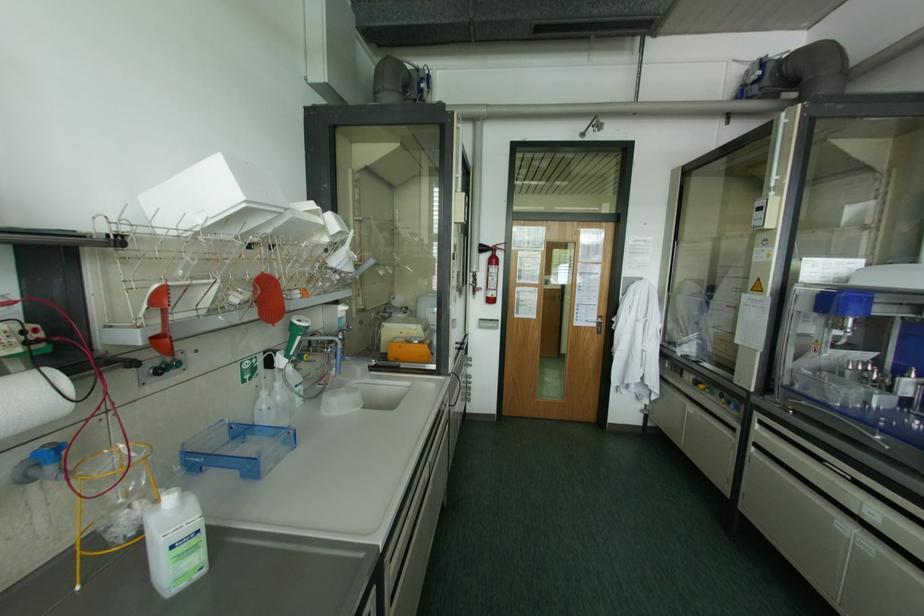
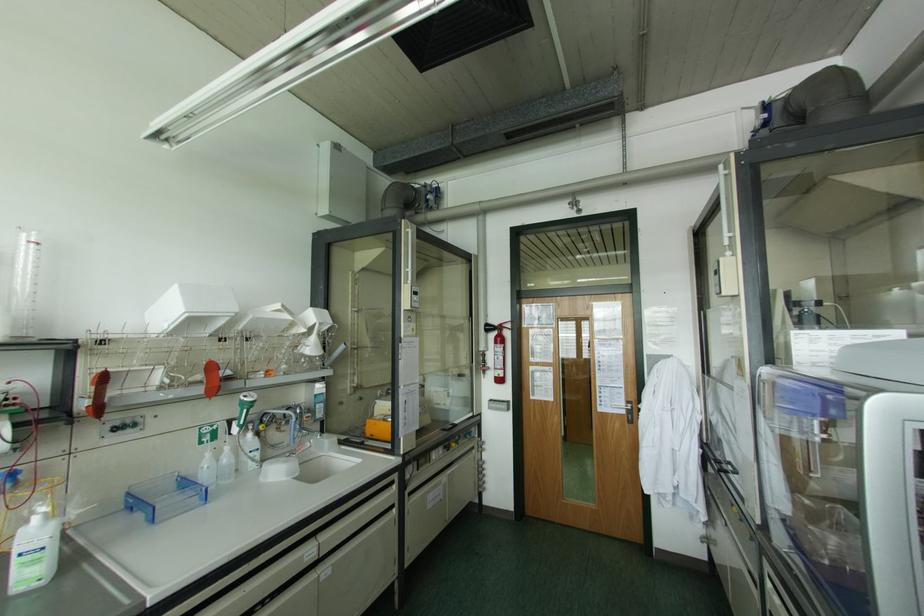
Find the pixel in the second image that matches the point at 159,370 in the first image.

(115, 428)